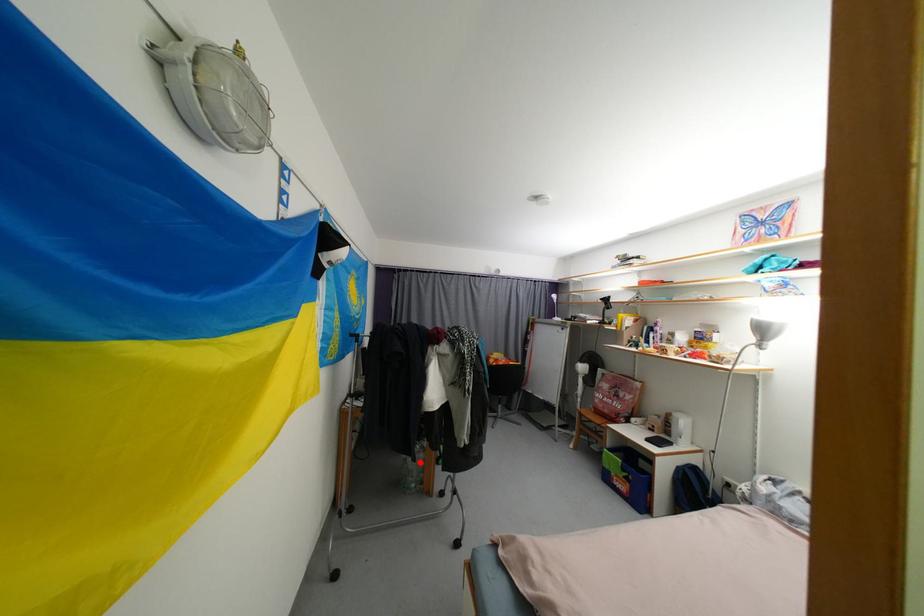
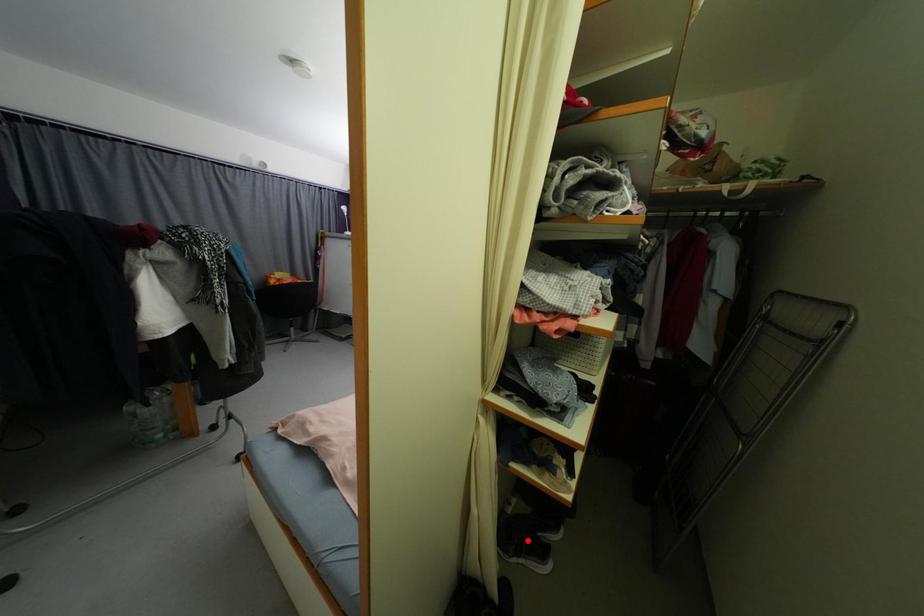
I am providing you with two images of the same scene from different viewpoints. A red point is marked on the first image and another point is marked on the second image. Is the marked point in image1 the same physical position as the marked point in image2?

Answer: No